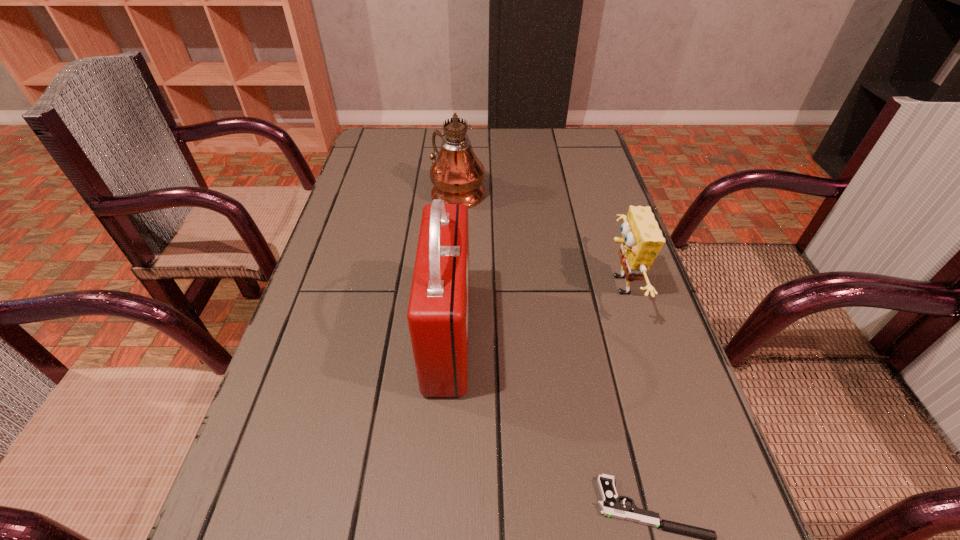
At what (x,y) coordinates should I click in order to perform the action: click on oil lamp. Please return your answer as a coordinate pair (x, y). Image resolution: width=960 pixels, height=540 pixels. Looking at the image, I should click on (456, 173).

I want to click on the tallest object, so click(456, 173).

At what (x,y) coordinates should I click in order to perform the action: click on the third shortest object. Please return your answer as a coordinate pair (x, y). Looking at the image, I should click on (438, 312).

Locate an element on the screen. This screenshot has height=540, width=960. the second shortest object is located at coordinates (642, 240).

Image resolution: width=960 pixels, height=540 pixels. Identify the location of free space located 0.310m on the front of the tallest object. (450, 298).

Identify the location of blank space located 0.360m on the front face of the first-aid kit. This screenshot has width=960, height=540. (655, 337).

This screenshot has height=540, width=960. In order to click on blank space located 0.350m on the face of the third tallest object in this screenshot , I will do `click(439, 286)`.

The height and width of the screenshot is (540, 960). Find the location of `vacant space situated on the face of the third tallest object`. vacant space situated on the face of the third tallest object is located at coordinates (537, 286).

Locate an element on the screen. This screenshot has height=540, width=960. free space located 0.370m on the face of the third tallest object is located at coordinates (430, 286).

The height and width of the screenshot is (540, 960). In order to click on object located at the right edge in this screenshot , I will do `click(642, 240)`.